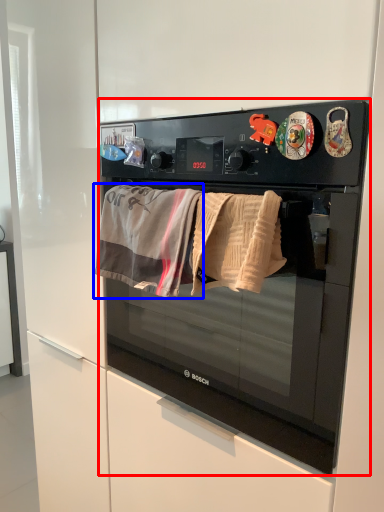
Question: Which point is closer to the camera, microwave oven (highlighted by a red box) or beach towel (highlighted by a blue box)?

Choices:
 (A) microwave oven
 (B) beach towel

Answer: (A)